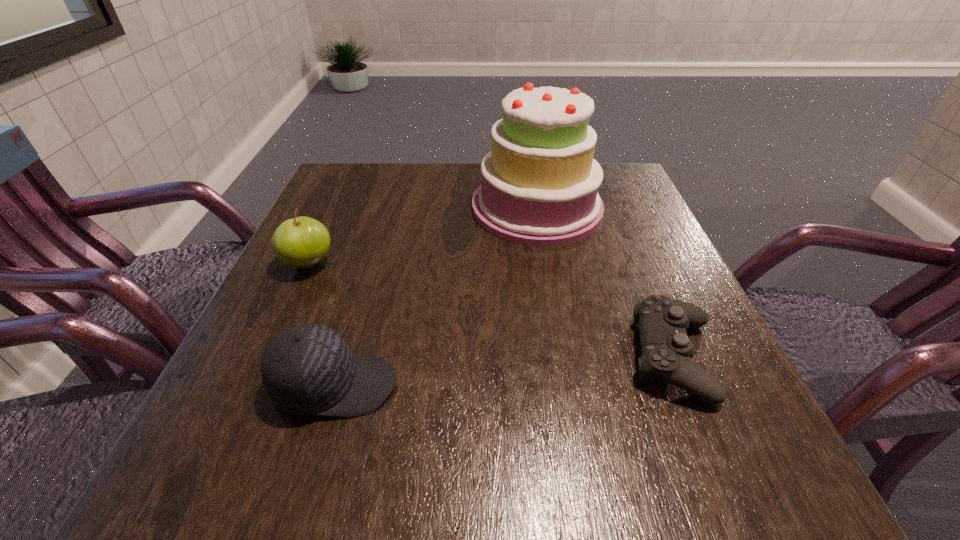
The image size is (960, 540). Identify the location of apple located at the left edge. (302, 242).

The height and width of the screenshot is (540, 960). Find the location of `baseball cap present at the left edge`. baseball cap present at the left edge is located at coordinates (308, 369).

Where is `cake located at the right edge`? The width and height of the screenshot is (960, 540). cake located at the right edge is located at coordinates (539, 187).

Where is `control present at the right edge`? Image resolution: width=960 pixels, height=540 pixels. control present at the right edge is located at coordinates coord(667,351).

Locate an element on the screen. The width and height of the screenshot is (960, 540). object that is positioned at the far right corner is located at coordinates (539, 187).

Locate an element on the screen. vacant space at the far edge of the desktop is located at coordinates (427, 178).

Identify the location of free point at the near edge. The image size is (960, 540). (564, 441).

In the image, there is a desktop. Identify the location of vacant region at the left edge. (354, 237).

Where is `free space at the right edge`? free space at the right edge is located at coordinates (658, 239).

Find the location of `vacant space at the far left corner of the desktop`. vacant space at the far left corner of the desktop is located at coordinates (380, 177).